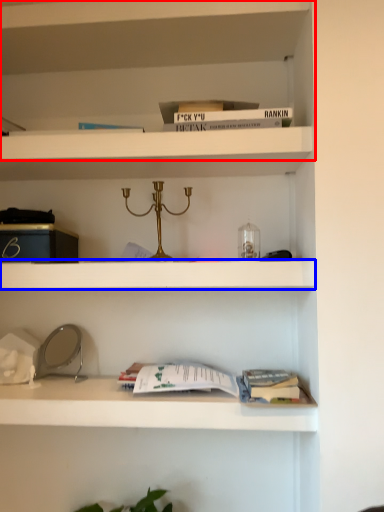
Question: Which object appears closest to the camera in this image, shelf (highlighted by a red box) or cabinet (highlighted by a blue box)?

Choices:
 (A) shelf
 (B) cabinet

Answer: (B)